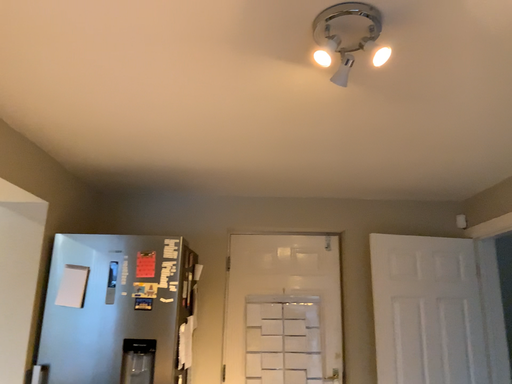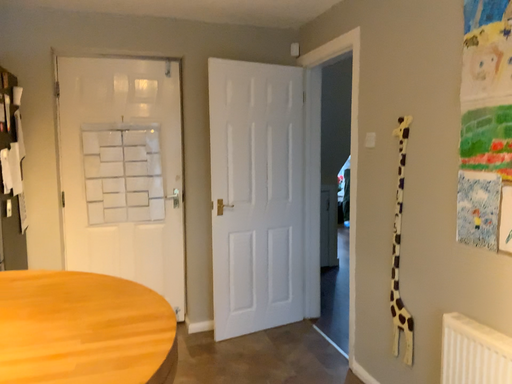
Question: How did the camera likely rotate when shooting the video?

Choices:
 (A) rotated downward
 (B) rotated upward

Answer: (A)